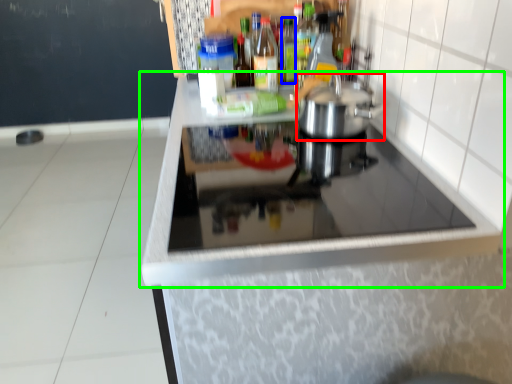
Question: Considering the real-world distances, which object is farthest from kitchen appliance (highlighted by a red box)? bottle (highlighted by a blue box) or countertop (highlighted by a green box)?

Choices:
 (A) bottle
 (B) countertop

Answer: (A)